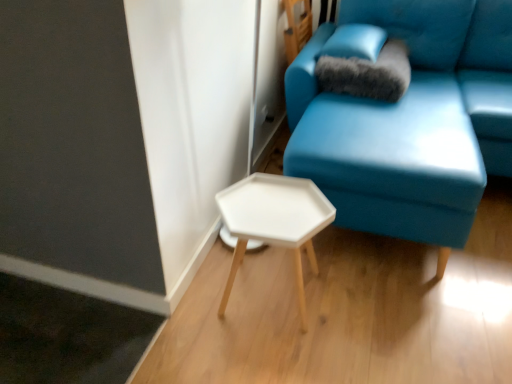
You are a GUI agent. You are given a task and a screenshot of the screen. Output one action in this format:
    pyautogui.click(x=<x>, y=<y>)
    Task: Click on the white matte hexagonal table at center
    
    Given the screenshot: What is the action you would take?
    pyautogui.click(x=274, y=222)

What do you see at coordinates (396, 131) in the screenshot? I see `matte blue couch at center` at bounding box center [396, 131].

Describe the element at coordinates (367, 73) in the screenshot. I see `fuzzy gray pillow at upper right, marked as the first pillow in a bottom-to-top arrangement` at that location.

At what (x,y) coordinates should I click in order to perform the action: click on white matte hexagonal table at center. Please return your answer as a coordinate pair (x, y). The height and width of the screenshot is (384, 512). Looking at the image, I should click on (274, 222).

This screenshot has width=512, height=384. What are the coordinates of `table that appears below the satin blue pillow at upper right, marked as the 1th pillow in a top-to-bottom arrangement (from a real-world perspective)` in the screenshot? It's located at (274, 222).

Does white matte hexagonal table at center contain satin blue pillow at upper right, marked as the 1th pillow in a top-to-bottom arrangement?

No, satin blue pillow at upper right, marked as the 1th pillow in a top-to-bottom arrangement, is not surrounded by white matte hexagonal table at center.

Looking at this image, considering the sizes of white matte hexagonal table at center and satin blue pillow at upper right, marked as the 1th pillow in a top-to-bottom arrangement, in the image, is white matte hexagonal table at center taller or shorter than satin blue pillow at upper right, marked as the 1th pillow in a top-to-bottom arrangement,?

white matte hexagonal table at center is taller than satin blue pillow at upper right, marked as the 1th pillow in a top-to-bottom arrangement.

Is fuzzy gray pillow at upper right, marked as the first pillow in a bottom-to-top arrangement, positioned far away from matte blue couch at center?

No, fuzzy gray pillow at upper right, marked as the first pillow in a bottom-to-top arrangement, is not far from matte blue couch at center.

Can you tell me how much fuzzy gray pillow at upper right, positioned as the second pillow in top-to-bottom order, and matte blue couch at center differ in facing direction?

The facing directions of fuzzy gray pillow at upper right, positioned as the second pillow in top-to-bottom order, and matte blue couch at center are 0.8 degrees apart.

Does point (399, 49) lie in front of point (315, 46)?

No.

Who is smaller, fuzzy gray pillow at upper right, positioned as the second pillow in top-to-bottom order, or matte blue couch at center?

fuzzy gray pillow at upper right, positioned as the second pillow in top-to-bottom order, is smaller.

Is white matte hexagonal table at center touching fuzzy gray pillow at upper right, positioned as the second pillow in top-to-bottom order?

There is a gap between white matte hexagonal table at center and fuzzy gray pillow at upper right, positioned as the second pillow in top-to-bottom order.

Considering the relative sizes of white matte hexagonal table at center and fuzzy gray pillow at upper right, positioned as the second pillow in top-to-bottom order, in the image provided, is white matte hexagonal table at center bigger than fuzzy gray pillow at upper right, positioned as the second pillow in top-to-bottom order,?

Yes, white matte hexagonal table at center is bigger than fuzzy gray pillow at upper right, positioned as the second pillow in top-to-bottom order.

Where is `table that appears on the left of fuzzy gray pillow at upper right, marked as the first pillow in a bottom-to-top arrangement`? The width and height of the screenshot is (512, 384). table that appears on the left of fuzzy gray pillow at upper right, marked as the first pillow in a bottom-to-top arrangement is located at coordinates (274, 222).

Looking at their sizes, would you say white matte hexagonal table at center is wider or thinner than fuzzy gray pillow at upper right, marked as the first pillow in a bottom-to-top arrangement?

Clearly, white matte hexagonal table at center has less width compared to fuzzy gray pillow at upper right, marked as the first pillow in a bottom-to-top arrangement.

Which of these two, satin blue pillow at upper right, marked as the 1th pillow in a top-to-bottom arrangement, or matte blue couch at center, is bigger?

With larger size is matte blue couch at center.

Is satin blue pillow at upper right, placed as the 2th pillow when sorted from bottom to top, not near matte blue couch at center?

No, satin blue pillow at upper right, placed as the 2th pillow when sorted from bottom to top, is not far from matte blue couch at center.

Find the location of a particular element. The width and height of the screenshot is (512, 384). studio couch on the right of satin blue pillow at upper right, marked as the 1th pillow in a top-to-bottom arrangement is located at coordinates (396, 131).

Which of these two, satin blue pillow at upper right, placed as the 2th pillow when sorted from bottom to top, or matte blue couch at center, stands shorter?

With less height is satin blue pillow at upper right, placed as the 2th pillow when sorted from bottom to top.

Between matte blue couch at center and white matte hexagonal table at center, which one has less height?

With less height is white matte hexagonal table at center.

Which is less distant, (485, 179) or (218, 311)?

Point (485, 179).

Can you confirm if matte blue couch at center is bigger than white matte hexagonal table at center?

Yes.

The width and height of the screenshot is (512, 384). Identify the location of pillow that is the 2nd object located above the matte blue couch at center (from the image's perspective). (x=355, y=42).

Could you tell me if matte blue couch at center is turned towards satin blue pillow at upper right, marked as the 1th pillow in a top-to-bottom arrangement?

No, matte blue couch at center is not turned towards satin blue pillow at upper right, marked as the 1th pillow in a top-to-bottom arrangement.

Is matte blue couch at center at the right side of satin blue pillow at upper right, marked as the 1th pillow in a top-to-bottom arrangement?

Indeed, matte blue couch at center is positioned on the right side of satin blue pillow at upper right, marked as the 1th pillow in a top-to-bottom arrangement.

Would you say matte blue couch at center is a long distance from satin blue pillow at upper right, placed as the 2th pillow when sorted from bottom to top?

matte blue couch at center is near satin blue pillow at upper right, placed as the 2th pillow when sorted from bottom to top, not far away.

Are satin blue pillow at upper right, placed as the 2th pillow when sorted from bottom to top, and fuzzy gray pillow at upper right, positioned as the second pillow in top-to-bottom order, beside each other?

No, satin blue pillow at upper right, placed as the 2th pillow when sorted from bottom to top, is not touching fuzzy gray pillow at upper right, positioned as the second pillow in top-to-bottom order.

Consider the image. Can you tell me how much satin blue pillow at upper right, marked as the 1th pillow in a top-to-bottom arrangement, and fuzzy gray pillow at upper right, positioned as the second pillow in top-to-bottom order, differ in facing direction?

1.29 degrees.

Considering the relative sizes of satin blue pillow at upper right, placed as the 2th pillow when sorted from bottom to top, and fuzzy gray pillow at upper right, marked as the first pillow in a bottom-to-top arrangement, in the image provided, is satin blue pillow at upper right, placed as the 2th pillow when sorted from bottom to top, bigger than fuzzy gray pillow at upper right, marked as the first pillow in a bottom-to-top arrangement,?

No.

Find the location of `table in front of the satin blue pillow at upper right, marked as the 1th pillow in a top-to-bottom arrangement`. table in front of the satin blue pillow at upper right, marked as the 1th pillow in a top-to-bottom arrangement is located at coordinates (274, 222).

From a real-world perspective, starting from the matte blue couch at center, which pillow is the 1st one vertically above it? Please provide its 2D coordinates.

[(367, 73)]

When comparing their distances from white matte hexagonal table at center, does fuzzy gray pillow at upper right, positioned as the second pillow in top-to-bottom order, or matte blue couch at center seem closer?

matte blue couch at center lies closer to white matte hexagonal table at center than the other object.

When comparing their distances from fuzzy gray pillow at upper right, positioned as the second pillow in top-to-bottom order, does matte blue couch at center or satin blue pillow at upper right, marked as the 1th pillow in a top-to-bottom arrangement, seem further?

matte blue couch at center is further to fuzzy gray pillow at upper right, positioned as the second pillow in top-to-bottom order.

Looking at the image, which one is located further to matte blue couch at center, satin blue pillow at upper right, placed as the 2th pillow when sorted from bottom to top, or white matte hexagonal table at center?

white matte hexagonal table at center lies further to matte blue couch at center than the other object.

Based on their spatial positions, is satin blue pillow at upper right, marked as the 1th pillow in a top-to-bottom arrangement, or fuzzy gray pillow at upper right, marked as the first pillow in a bottom-to-top arrangement, further from matte blue couch at center?

The object further to matte blue couch at center is satin blue pillow at upper right, marked as the 1th pillow in a top-to-bottom arrangement.

Looking at the image, which one is located further to fuzzy gray pillow at upper right, marked as the first pillow in a bottom-to-top arrangement, satin blue pillow at upper right, marked as the 1th pillow in a top-to-bottom arrangement, or matte blue couch at center?

Among the two, matte blue couch at center is located further to fuzzy gray pillow at upper right, marked as the first pillow in a bottom-to-top arrangement.

Considering their positions, is matte blue couch at center positioned further to fuzzy gray pillow at upper right, marked as the first pillow in a bottom-to-top arrangement, than white matte hexagonal table at center?

white matte hexagonal table at center lies further to fuzzy gray pillow at upper right, marked as the first pillow in a bottom-to-top arrangement, than the other object.

From the image, which object appears to be farther from fuzzy gray pillow at upper right, marked as the first pillow in a bottom-to-top arrangement, white matte hexagonal table at center or matte blue couch at center?

white matte hexagonal table at center.

Consider the image. From the image, which object appears to be nearer to white matte hexagonal table at center, matte blue couch at center or satin blue pillow at upper right, placed as the 2th pillow when sorted from bottom to top?

Among the two, matte blue couch at center is located nearer to white matte hexagonal table at center.

You are a GUI agent. You are given a task and a screenshot of the screen. Output one action in this format:
    pyautogui.click(x=<x>, y=<y>)
    Task: Click on the studio couch between fuzzy gray pillow at upper right, positioned as the second pillow in top-to-bottom order, and white matte hexagonal table at center in the up-down direction
    The image size is (512, 384).
    Given the screenshot: What is the action you would take?
    pyautogui.click(x=396, y=131)

This screenshot has width=512, height=384. I want to click on pillow positioned between matte blue couch at center and satin blue pillow at upper right, marked as the 1th pillow in a top-to-bottom arrangement, from near to far, so click(367, 73).

Locate an element on the screen. pillow that lies between satin blue pillow at upper right, placed as the 2th pillow when sorted from bottom to top, and white matte hexagonal table at center from top to bottom is located at coordinates (367, 73).

Image resolution: width=512 pixels, height=384 pixels. I want to click on studio couch between satin blue pillow at upper right, placed as the 2th pillow when sorted from bottom to top, and white matte hexagonal table at center, in the vertical direction, so click(x=396, y=131).